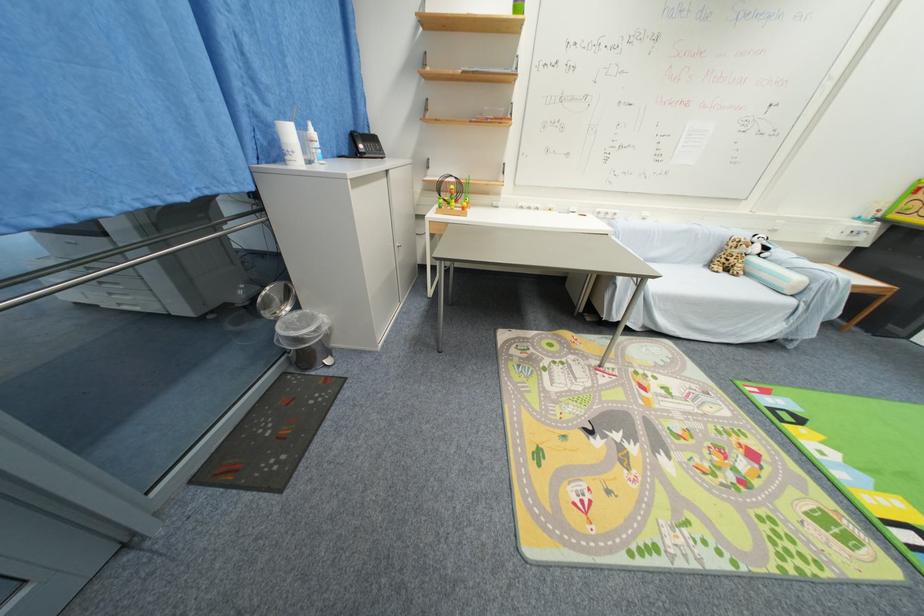
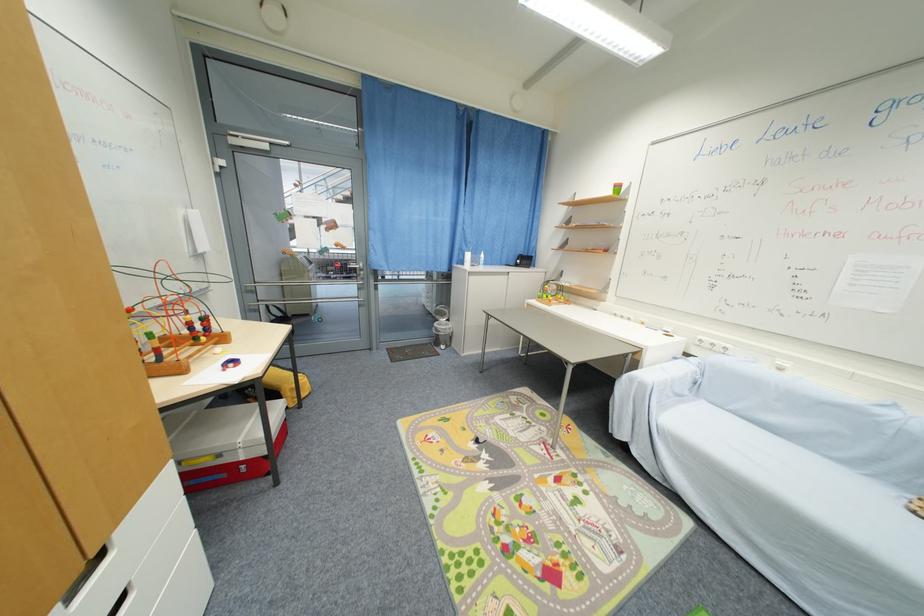
Find the pixel in the second image that matches pixel 614 217 in the first image.

(723, 351)